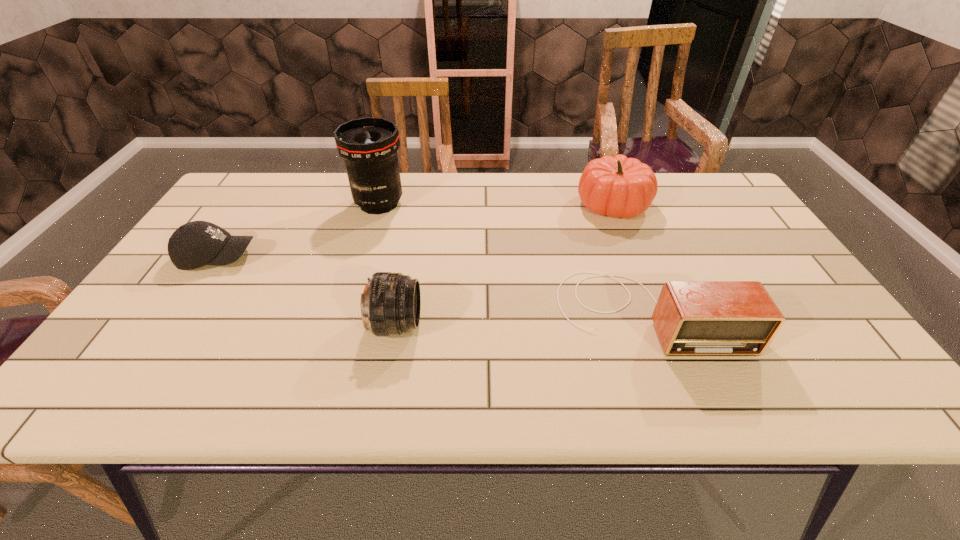
I want to click on vacant space in between the leftmost object and the nearer telephoto lens, so click(307, 291).

You are a GUI agent. You are given a task and a screenshot of the screen. Output one action in this format:
    pyautogui.click(x=<x>, y=<y>)
    Task: Click on the vacant space that is in between the pumpkin and the nearer telephoto lens
    The image size is (960, 540).
    Given the screenshot: What is the action you would take?
    pyautogui.click(x=505, y=265)

Identify which object is the second nearest to the pumpkin. Please provide its 2D coordinates. Your answer should be formatted as a tuple, i.e. [(x, y)], where the tuple contains the x and y coordinates of a point satisfying the conditions above.

[(369, 145)]

At what (x,y) coordinates should I click in order to perform the action: click on the fourth closest object relative to the shorter telephoto lens. Please return your answer as a coordinate pair (x, y). Looking at the image, I should click on (618, 186).

Image resolution: width=960 pixels, height=540 pixels. I want to click on free space that satisfies the following two spatial constraints: 1. on the front-facing side of the radio receiver; 2. at the front element of the shorter telephoto lens, so click(x=652, y=325).